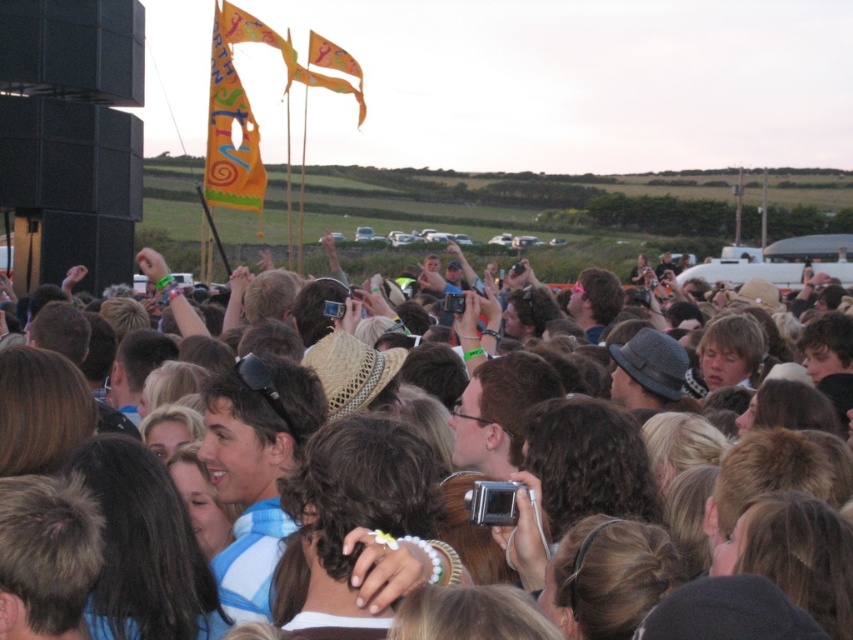
Does brown hair at center appear under orange fabric flag at upper left?

Yes, brown hair at center is below orange fabric flag at upper left.

Between brown hair at center and orange fabric flag at upper left, which one has more height?

orange fabric flag at upper left

Between point (523, 472) and point (241, 179), which one is positioned behind?

The point (241, 179) is more distant.

The height and width of the screenshot is (640, 853). I want to click on brown hair at center, so click(370, 577).